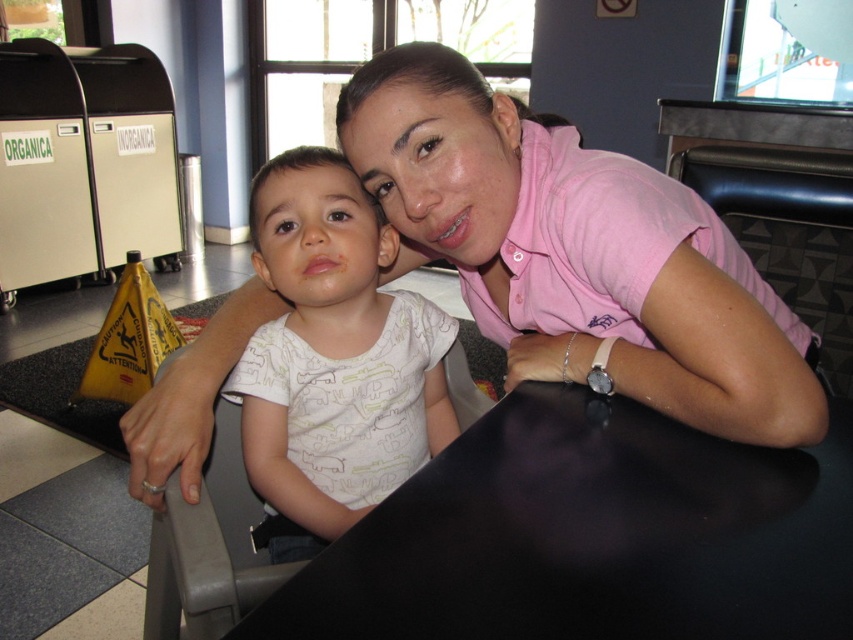
Question: Is pink cotton shirt at center above white printed shirt at center?

Choices:
 (A) yes
 (B) no

Answer: (A)

Question: Is pink cotton shirt at center above white printed shirt at center?

Choices:
 (A) yes
 (B) no

Answer: (A)

Question: Which point appears farthest from the camera in this image?

Choices:
 (A) (587, 305)
 (B) (305, 186)

Answer: (B)

Question: Which point is closer to the camera?

Choices:
 (A) (788, 444)
 (B) (320, 205)

Answer: (A)

Question: Which of the following is the farthest from the observer?

Choices:
 (A) (572, 243)
 (B) (329, 154)

Answer: (B)

Question: Does pink cotton shirt at center have a greater width compared to white printed shirt at center?

Choices:
 (A) no
 (B) yes

Answer: (B)